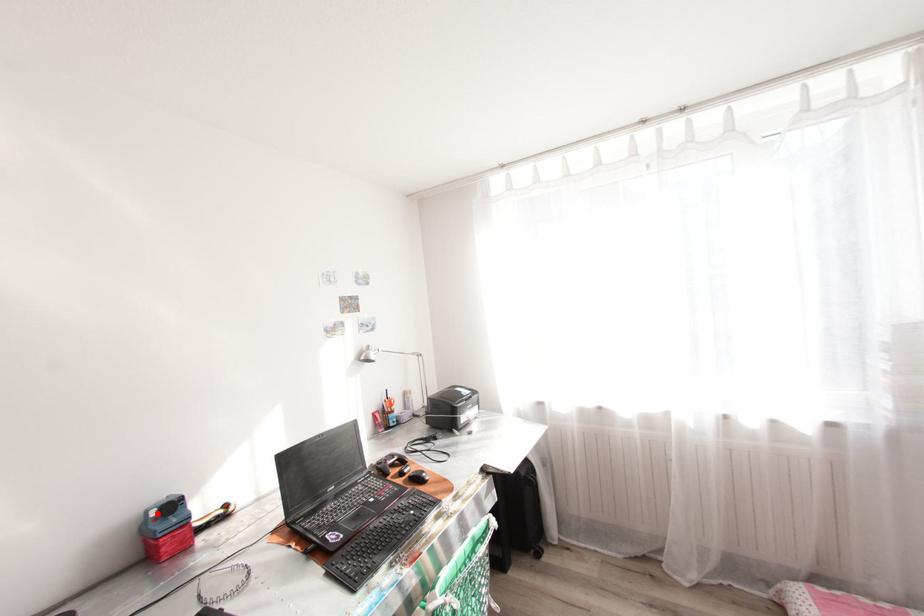
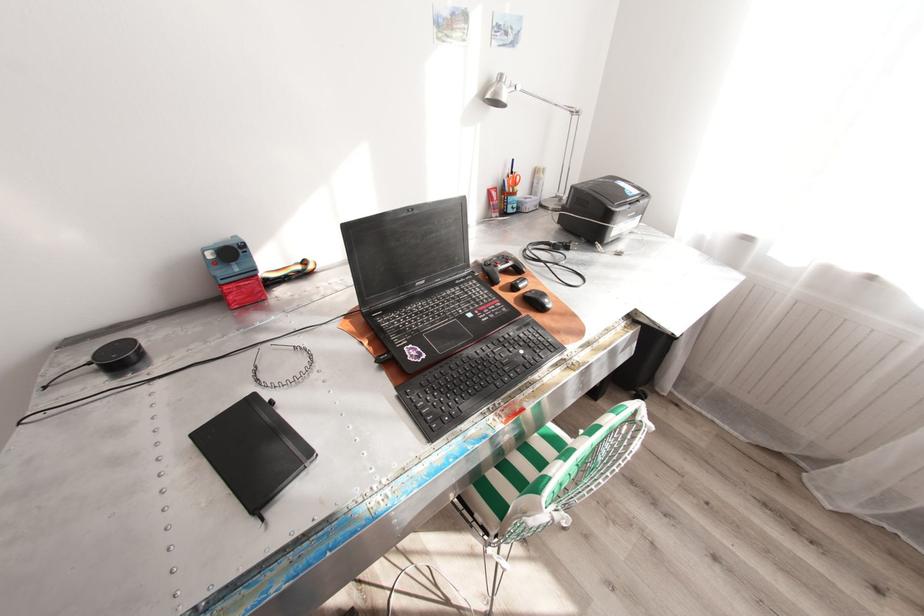
Question: I am providing you with two images of the same scene from different viewpoints. A red point is marked on the first image. At the location where the point appears in image 1, is it still visible in image 2?

Choices:
 (A) Yes
 (B) No

Answer: (A)